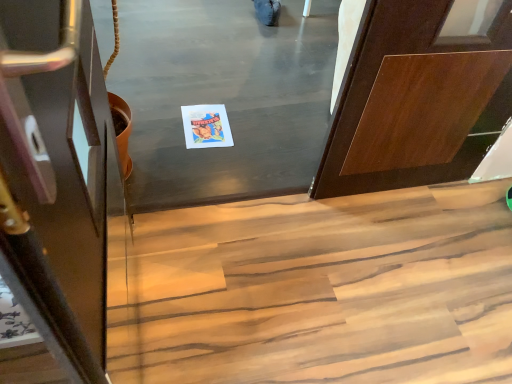
Question: Could you tell me if wooden stairs at lower center is turned towards shiny dark wood door at left?

Choices:
 (A) no
 (B) yes

Answer: (A)

Question: Is wooden stairs at lower center looking in the opposite direction of shiny dark wood door at left?

Choices:
 (A) yes
 (B) no

Answer: (B)

Question: Can you confirm if wooden stairs at lower center is smaller than shiny dark wood door at left?

Choices:
 (A) yes
 (B) no

Answer: (B)

Question: Considering the relative positions of wooden stairs at lower center and shiny dark wood door at left in the image provided, is wooden stairs at lower center to the right of shiny dark wood door at left from the viewer's perspective?

Choices:
 (A) no
 (B) yes

Answer: (B)

Question: From the image's perspective, would you say wooden stairs at lower center is shown under shiny dark wood door at left?

Choices:
 (A) yes
 (B) no

Answer: (A)

Question: Visually, is wooden stairs at lower center positioned to the left or to the right of matte paper postcard at center?

Choices:
 (A) right
 (B) left

Answer: (A)

Question: In the image, is wooden stairs at lower center positioned in front of or behind matte paper postcard at center?

Choices:
 (A) front
 (B) behind

Answer: (A)

Question: Considering the positions of wooden stairs at lower center and matte paper postcard at center in the image, is wooden stairs at lower center bigger or smaller than matte paper postcard at center?

Choices:
 (A) big
 (B) small

Answer: (A)

Question: Is point (185, 218) positioned closer to the camera than point (190, 135)?

Choices:
 (A) closer
 (B) farther

Answer: (A)

Question: Based on their positions, is shiny dark wood door at left located to the left or right of wooden stairs at lower center?

Choices:
 (A) left
 (B) right

Answer: (A)

Question: Is shiny dark wood door at left in front of or behind wooden stairs at lower center in the image?

Choices:
 (A) behind
 (B) front

Answer: (B)

Question: Is shiny dark wood door at left bigger or smaller than wooden stairs at lower center?

Choices:
 (A) big
 (B) small

Answer: (B)

Question: Is point pos(2,158) positioned closer to the camera than point pos(501,273)?

Choices:
 (A) farther
 (B) closer

Answer: (B)

Question: From the image's perspective, is wooden stairs at lower center located above or below shiny dark wood door at left?

Choices:
 (A) below
 (B) above

Answer: (A)

Question: Is wooden stairs at lower center in front of or behind shiny dark wood door at left in the image?

Choices:
 (A) behind
 (B) front

Answer: (A)